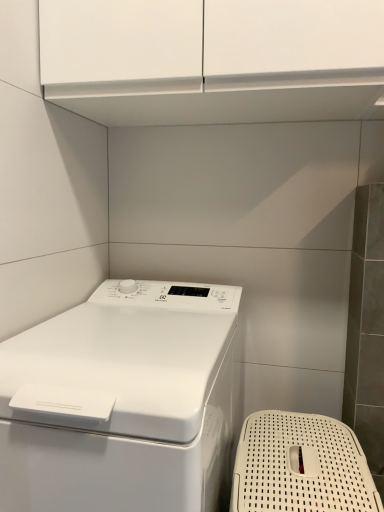
Question: Based on their positions, is white plastic basket at lower right located to the left or right of white glossy washing machine at lower left?

Choices:
 (A) right
 (B) left

Answer: (A)

Question: Would you say white plastic basket at lower right is inside or outside white glossy washing machine at lower left?

Choices:
 (A) outside
 (B) inside

Answer: (A)

Question: Is white plastic basket at lower right bigger or smaller than white glossy washing machine at lower left?

Choices:
 (A) small
 (B) big

Answer: (A)

Question: Is point 74,483 positioned closer to the camera than point 284,460?

Choices:
 (A) closer
 (B) farther

Answer: (A)

Question: Do you think white glossy washing machine at lower left is within white plastic basket at lower right, or outside of it?

Choices:
 (A) inside
 (B) outside

Answer: (B)

Question: From the image's perspective, is white glossy washing machine at lower left above or below white plastic basket at lower right?

Choices:
 (A) below
 (B) above

Answer: (B)

Question: Is white glossy washing machine at lower left in front of or behind white plastic basket at lower right in the image?

Choices:
 (A) front
 (B) behind

Answer: (A)